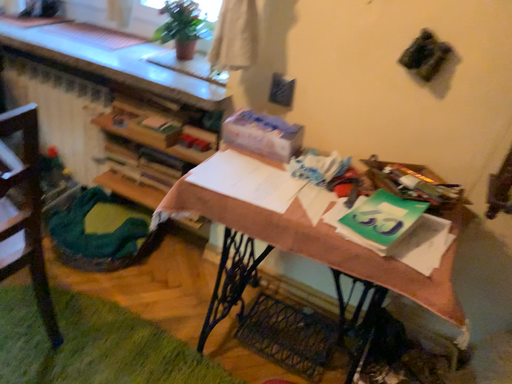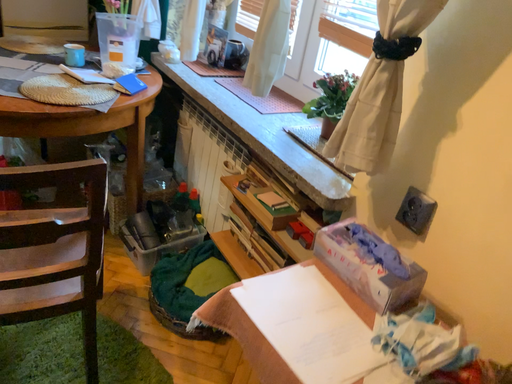
Question: Which way did the camera rotate in the video?

Choices:
 (A) rotated right
 (B) rotated left

Answer: (B)